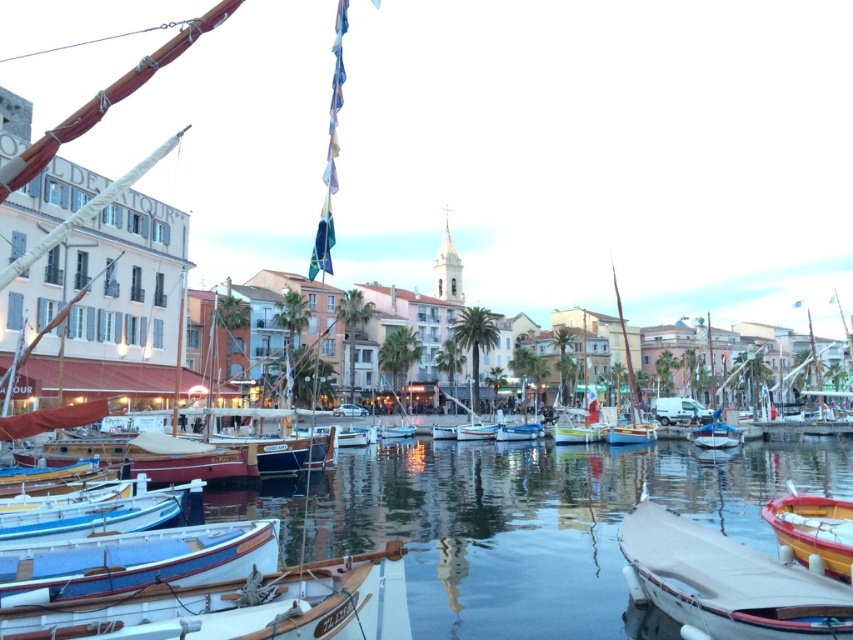
Does wooden boat at lower left appear over wooden sailboat at center?

No, wooden boat at lower left is not above wooden sailboat at center.

Between wooden boat at lower left and wooden sailboat at center, which one is positioned higher?

wooden sailboat at center

Locate an element on the screen. This screenshot has width=853, height=640. wooden boat at lower left is located at coordinates (238, 605).

Find the location of a particular element. The width and height of the screenshot is (853, 640). wooden boat at lower left is located at coordinates (238, 605).

Measure the distance from white canvas boat at lower right to wooden sailboat at center.

67.26 meters

Is point (737, 563) farther from camera compared to point (631, 380)?

That is False.

Which is behind, point (703, 586) or point (635, 400)?

The point (635, 400) is more distant.

Where is `white canvas boat at lower right`? white canvas boat at lower right is located at coordinates (724, 582).

Does blue polished wood boat at lower left have a greater width compared to wooden sailboat at center?

No.

Is blue polished wood boat at lower left positioned behind wooden sailboat at center?

That is False.

Who is more forward, (x=90, y=588) or (x=634, y=380)?

Point (x=90, y=588) is more forward.

Find the location of `blue polished wood boat at lower left`. blue polished wood boat at lower left is located at coordinates (136, 561).